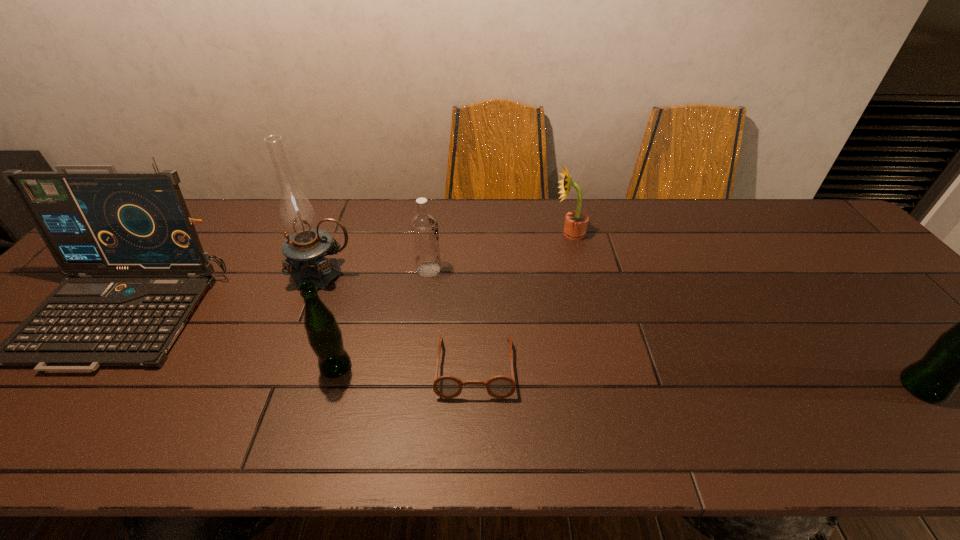
Please mark a free spot for a new beer_bottle to balance the arrangement. Please provide its 2D coordinates. Your answer should be formatted as a tuple, i.e. [(x, y)], where the tuple contains the x and y coordinates of a point satisfying the conditions above.

[(623, 377)]